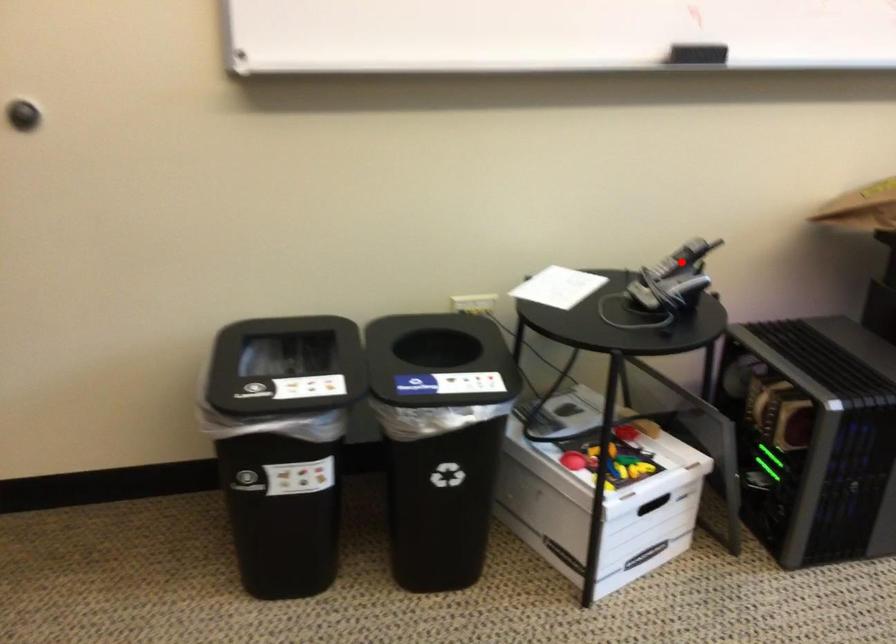
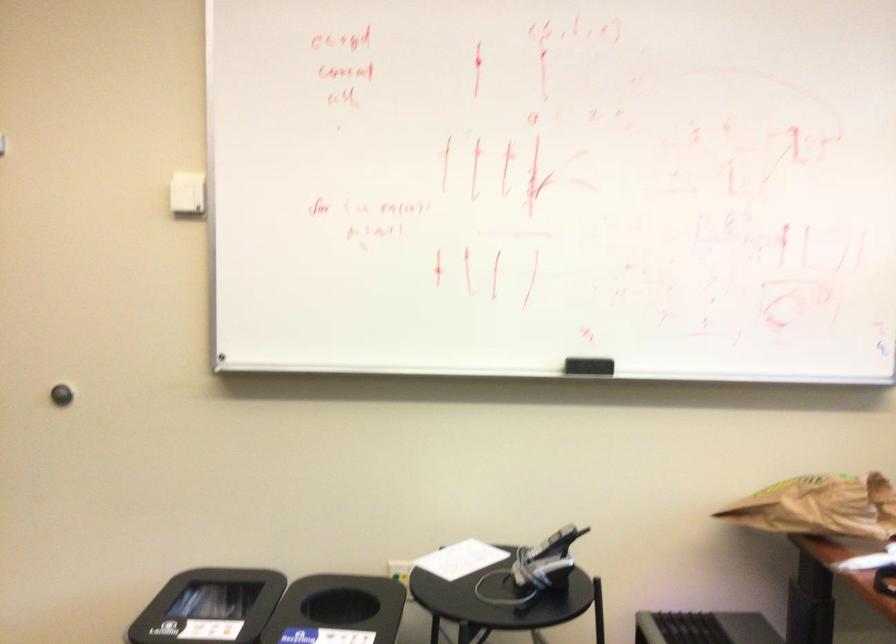
Question: I am providing you with two images of the same scene from different viewpoints. Image1 has a red point marked. In image2, the corresponding 3D location appears at what relative position? Reply with the corresponding letter.

Choices:
 (A) Closer
 (B) Farther

Answer: (B)